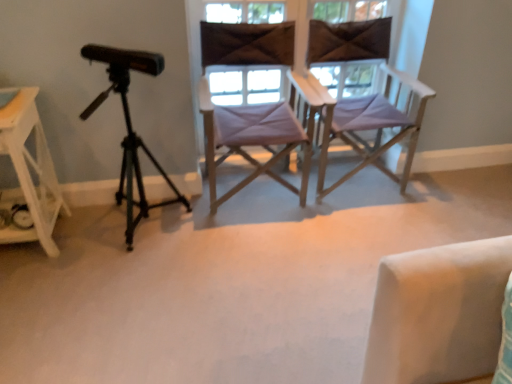
In order to click on free point to the right of white wood side table at left in this screenshot , I will do `click(88, 248)`.